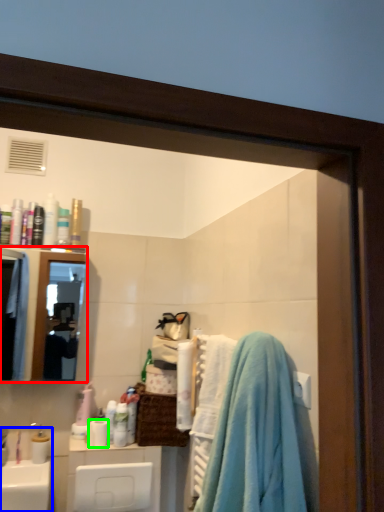
Question: Based on their relative distances, which object is farther from mirror (highlighted by a red box)? Choose from sink (highlighted by a blue box) and toilet paper (highlighted by a green box).

Choices:
 (A) sink
 (B) toilet paper

Answer: (B)